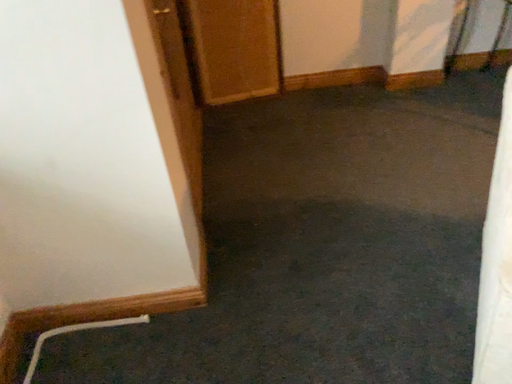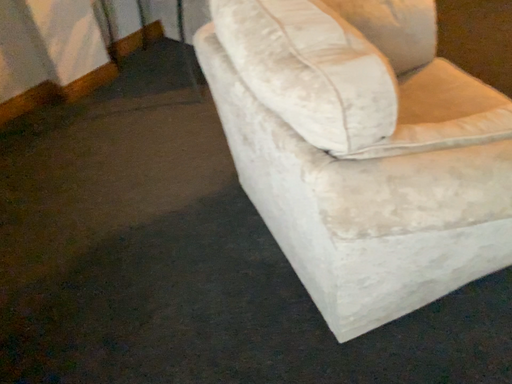
Question: How did the camera likely rotate when shooting the video?

Choices:
 (A) rotated right
 (B) rotated left

Answer: (A)